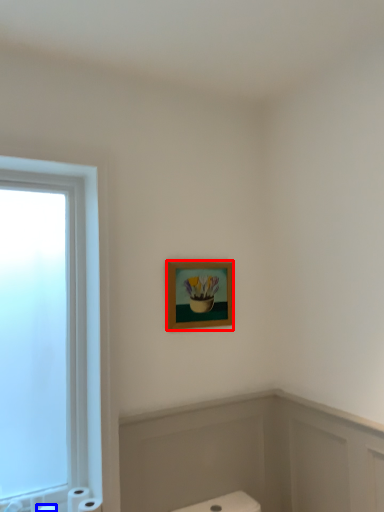
Question: Which object is further to the camera taking this photo, picture frame (highlighted by a red box) or toilet paper (highlighted by a blue box)?

Choices:
 (A) picture frame
 (B) toilet paper

Answer: (A)